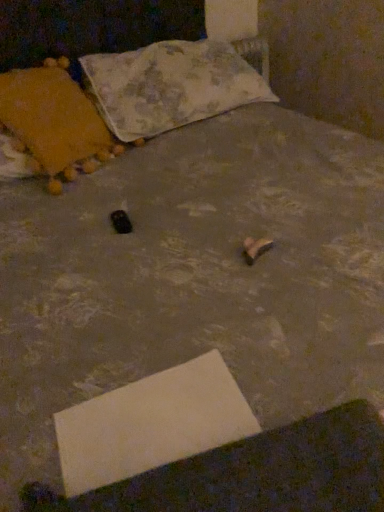
Question: From the image's perspective, is velvet orange pillow at left, acting as the 1th pillow starting from the left, located above white cardboard at lower center?

Choices:
 (A) yes
 (B) no

Answer: (A)

Question: Is velvet orange pillow at left, placed as the second pillow when sorted from right to left, taller than white cardboard at lower center?

Choices:
 (A) no
 (B) yes

Answer: (B)

Question: From a real-world perspective, does velvet orange pillow at left, acting as the 1th pillow starting from the left, sit lower than white cardboard at lower center?

Choices:
 (A) yes
 (B) no

Answer: (B)

Question: From the image's perspective, is velvet orange pillow at left, placed as the second pillow when sorted from right to left, under white cardboard at lower center?

Choices:
 (A) no
 (B) yes

Answer: (A)

Question: Is white cardboard at lower center at the back of velvet orange pillow at left, placed as the second pillow when sorted from right to left?

Choices:
 (A) yes
 (B) no

Answer: (B)

Question: From a real-world perspective, is velvet orange pillow at left, placed as the second pillow when sorted from right to left, positioned above or below fluffy fabric pillow at upper center, placed as the first pillow when sorted from right to left?

Choices:
 (A) above
 (B) below

Answer: (A)

Question: Is velvet orange pillow at left, acting as the 1th pillow starting from the left, bigger or smaller than fluffy fabric pillow at upper center, the second pillow from the left?

Choices:
 (A) big
 (B) small

Answer: (B)

Question: Relative to fluffy fabric pillow at upper center, placed as the first pillow when sorted from right to left, is velvet orange pillow at left, placed as the second pillow when sorted from right to left, in front or behind?

Choices:
 (A) front
 (B) behind

Answer: (A)

Question: Is velvet orange pillow at left, placed as the second pillow when sorted from right to left, wider or thinner than fluffy fabric pillow at upper center, the second pillow from the left?

Choices:
 (A) thin
 (B) wide

Answer: (A)

Question: From a real-world perspective, is white cardboard at lower center positioned above or below velvet orange pillow at left, placed as the second pillow when sorted from right to left?

Choices:
 (A) below
 (B) above

Answer: (A)

Question: Considering the relative positions of white cardboard at lower center and velvet orange pillow at left, acting as the 1th pillow starting from the left, in the image provided, is white cardboard at lower center to the left or to the right of velvet orange pillow at left, acting as the 1th pillow starting from the left,?

Choices:
 (A) right
 (B) left

Answer: (A)

Question: Is white cardboard at lower center situated inside velvet orange pillow at left, acting as the 1th pillow starting from the left, or outside?

Choices:
 (A) inside
 (B) outside

Answer: (B)

Question: From the image's perspective, is white cardboard at lower center located above or below velvet orange pillow at left, placed as the second pillow when sorted from right to left?

Choices:
 (A) below
 (B) above

Answer: (A)

Question: Would you say velvet orange pillow at left, acting as the 1th pillow starting from the left, is inside or outside white cardboard at lower center?

Choices:
 (A) outside
 (B) inside

Answer: (A)

Question: In terms of size, does velvet orange pillow at left, placed as the second pillow when sorted from right to left, appear bigger or smaller than white cardboard at lower center?

Choices:
 (A) big
 (B) small

Answer: (A)